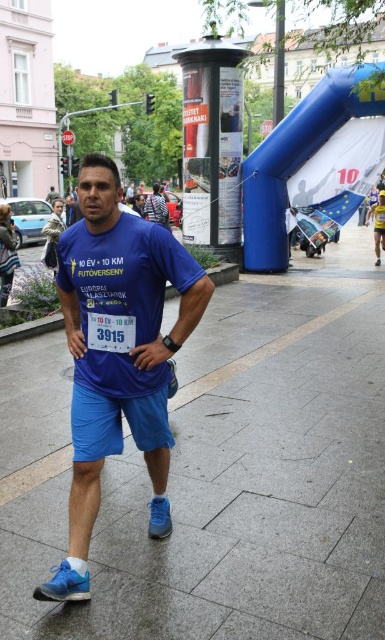
Question: Can you confirm if gray concrete pavement at center is positioned to the right of blue mesh running shoe at lower left?

Choices:
 (A) yes
 (B) no

Answer: (A)

Question: Can you confirm if blue fabric shorts at center is positioned above blue suede running shoe at lower left?

Choices:
 (A) no
 (B) yes

Answer: (B)

Question: Which of the following is the closest to the observer?

Choices:
 (A) blue matte t-shirt at center
 (B) blue suede running shoe at lower left

Answer: (A)

Question: Among these points, which one is nearest to the camera?

Choices:
 (A) (383, 246)
 (B) (120, 436)
 (C) (167, 508)

Answer: (B)

Question: Can you confirm if gray concrete pavement at center is smaller than blue matte t-shirt at center?

Choices:
 (A) no
 (B) yes

Answer: (A)

Question: Which of the following is the closest to the observer?

Choices:
 (A) pyautogui.click(x=152, y=518)
 (B) pyautogui.click(x=41, y=582)
 (C) pyautogui.click(x=246, y=595)
 (D) pyautogui.click(x=113, y=397)

Answer: (B)